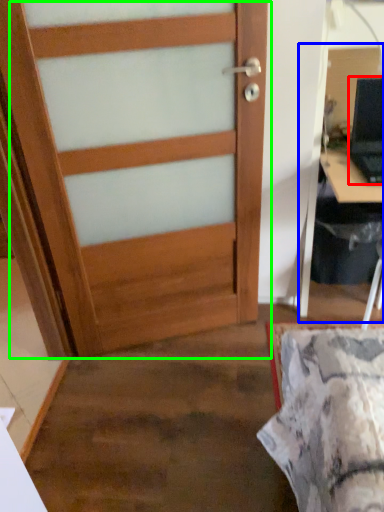
Question: Which object is the closest to the laptop (highlighted by a red box)? Choose among these: computer desk (highlighted by a blue box) or door (highlighted by a green box).

Choices:
 (A) computer desk
 (B) door

Answer: (A)